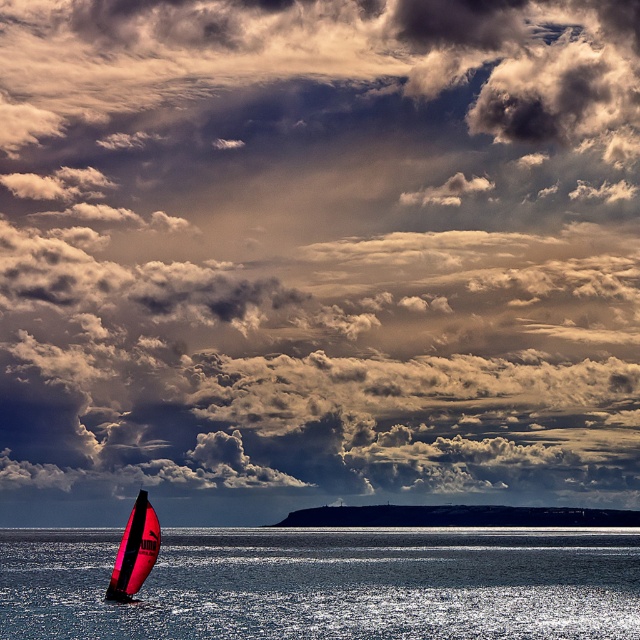
Question: Which of the following is the closest to the observer?

Choices:
 (A) (134, 524)
 (B) (497, 532)

Answer: (A)

Question: Considering the relative positions of transparent blue water at lower center and shiny pink sailboat at lower left in the image provided, where is transparent blue water at lower center located with respect to shiny pink sailboat at lower left?

Choices:
 (A) left
 (B) right

Answer: (B)

Question: Can you confirm if transparent blue water at lower center is bigger than shiny pink sailboat at lower left?

Choices:
 (A) no
 (B) yes

Answer: (B)

Question: From the image, what is the correct spatial relationship of transparent blue water at lower center in relation to shiny pink sailboat at lower left?

Choices:
 (A) below
 (B) above

Answer: (A)